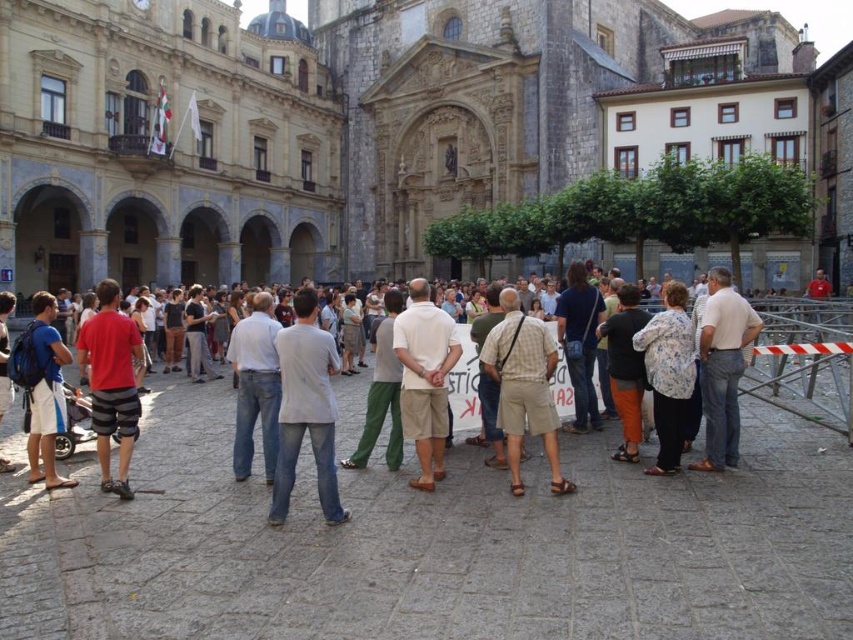
In the scene shown: Does plaid cotton shirt at center have a greater width compared to floral-patterned blouse at lower right?

Incorrect, plaid cotton shirt at center's width does not surpass floral-patterned blouse at lower right's.

Image resolution: width=853 pixels, height=640 pixels. What do you see at coordinates (523, 387) in the screenshot?
I see `plaid cotton shirt at center` at bounding box center [523, 387].

Does point (537, 342) come behind point (672, 406)?

Yes, it is.

The width and height of the screenshot is (853, 640). Identify the location of plaid cotton shirt at center. (523, 387).